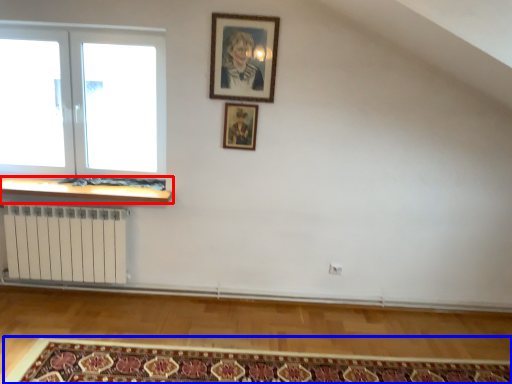
Question: Which object is further to the camera taking this photo, window sill (highlighted by a red box) or mat (highlighted by a blue box)?

Choices:
 (A) window sill
 (B) mat

Answer: (A)